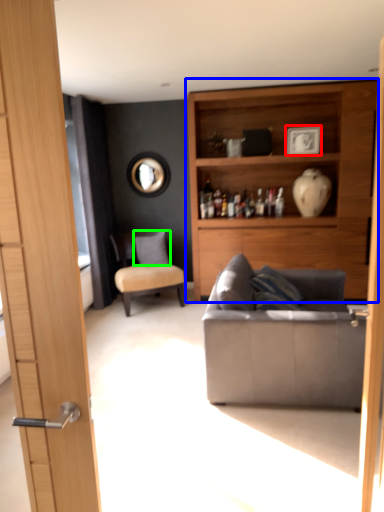
Question: Which is nearer to the picture frame (highlighted by a red box)? cabinetry (highlighted by a blue box) or pillow (highlighted by a green box).

Choices:
 (A) cabinetry
 (B) pillow

Answer: (A)